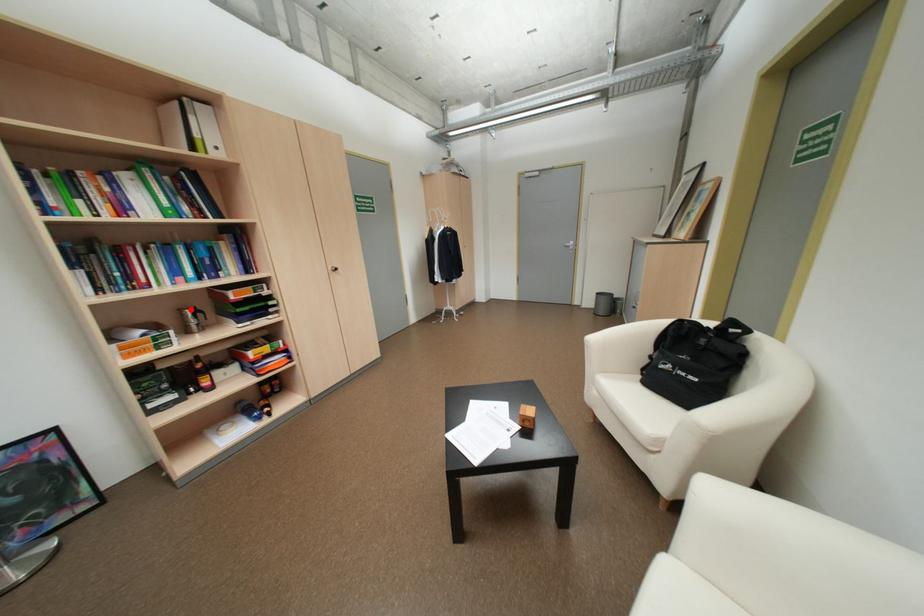
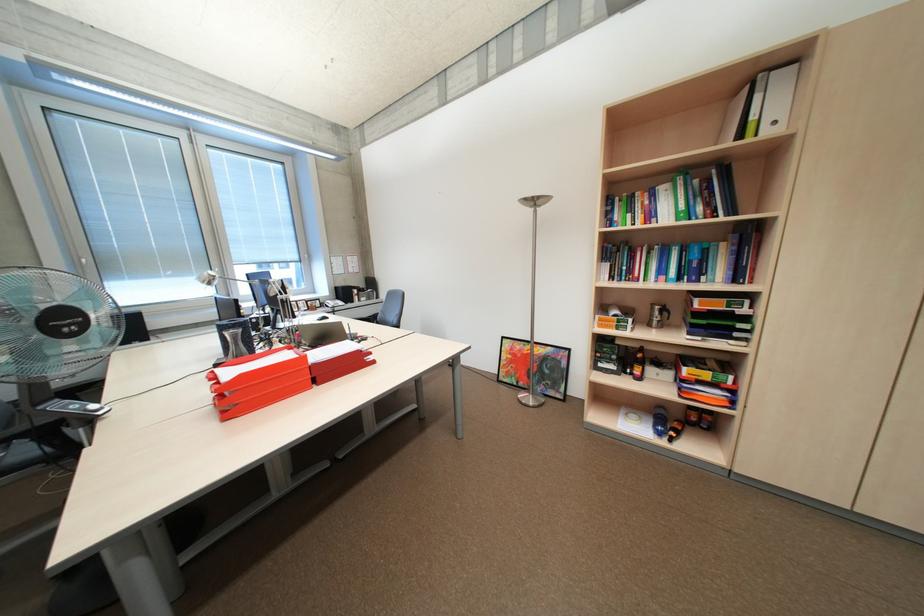
Locate, in the second image, the point that corresponds to the highlighted location in the first image.

(663, 304)